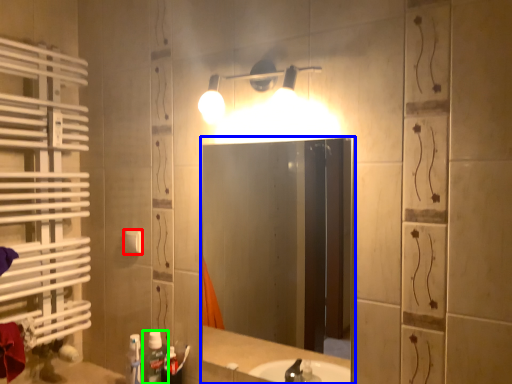
Question: Which object is positioned closest to light switch (highlighted by a red box)? Select from mirror (highlighted by a blue box) and bottle (highlighted by a green box).

Choices:
 (A) mirror
 (B) bottle

Answer: (B)